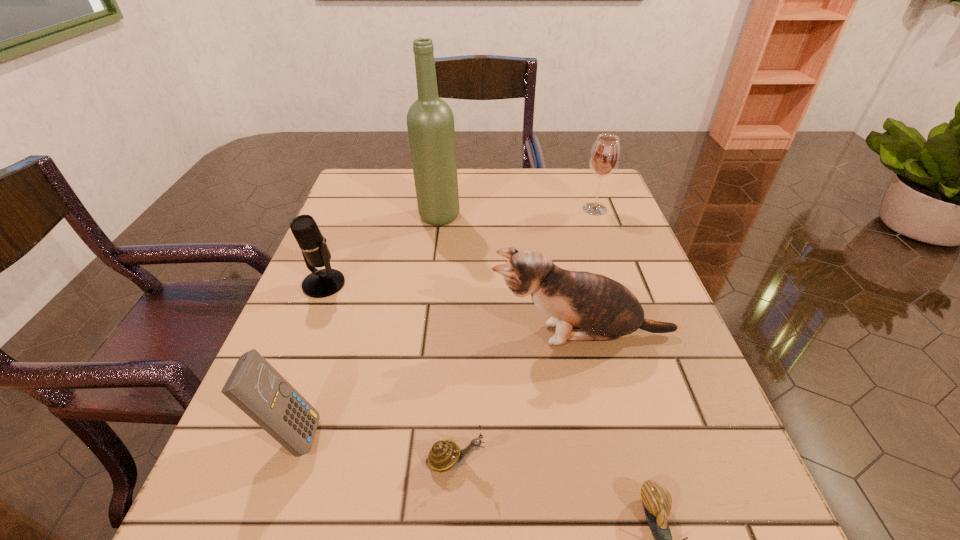
Where is `the tallest object`? The width and height of the screenshot is (960, 540). the tallest object is located at coordinates (430, 121).

Where is `wineglass`? Image resolution: width=960 pixels, height=540 pixels. wineglass is located at coordinates (605, 154).

Where is `cat`? The image size is (960, 540). cat is located at coordinates (605, 309).

I want to click on microphone, so click(x=321, y=283).

You are a GUI agent. You are given a task and a screenshot of the screen. Output one action in this format:
    pyautogui.click(x=<x>, y=<y>)
    Task: Click on the calculator
    The height and width of the screenshot is (540, 960).
    Given the screenshot: What is the action you would take?
    pyautogui.click(x=255, y=386)

Locate an element on the screen. The width and height of the screenshot is (960, 540). the taller escargot is located at coordinates (445, 454).

At what (x,y) coordinates should I click in order to perform the action: click on the left escargot. Please return your answer as a coordinate pair (x, y). This screenshot has height=540, width=960. Looking at the image, I should click on (445, 454).

You are a GUI agent. You are given a task and a screenshot of the screen. Output one action in this format:
    pyautogui.click(x=<x>, y=<y>)
    Task: Click on the vacant space located on the left of the tallest object
    This screenshot has width=960, height=540.
    Given the screenshot: What is the action you would take?
    pyautogui.click(x=342, y=217)

Locate an element on the screen. vacant space located on the left of the wineglass is located at coordinates point(526,209).

Where is `blank space located 0.270m at the face of the fourth farthest object`? blank space located 0.270m at the face of the fourth farthest object is located at coordinates (344, 335).